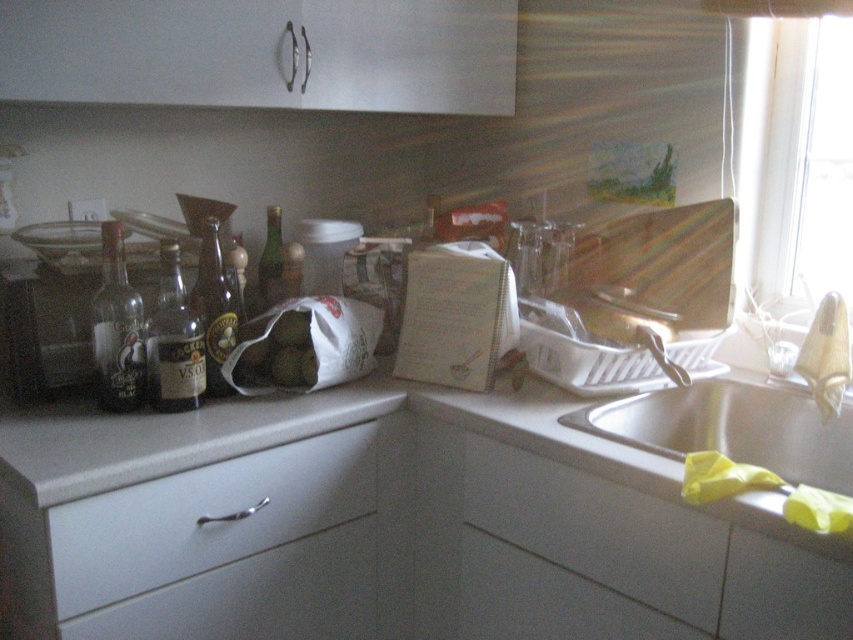
Is stainless steel sink at lower right positioned at the back of dark brown glass bottle at center-left?

No.

Does stainless steel sink at lower right have a larger size compared to dark brown glass bottle at center-left?

Correct, stainless steel sink at lower right is larger in size than dark brown glass bottle at center-left.

Is point (755, 387) farther from viewer compared to point (222, 276)?

Yes, it is behind point (222, 276).

At what (x,y) coordinates should I click in order to perform the action: click on stainless steel sink at lower right. Please return your answer as a coordinate pair (x, y). The height and width of the screenshot is (640, 853). Looking at the image, I should click on (732, 428).

Is point (682, 451) closer to viewer compared to point (120, 284)?

No, (682, 451) is further to viewer.

Is stainless steel sink at lower right to the left of clear glass bottle at left from the viewer's perspective?

In fact, stainless steel sink at lower right is to the right of clear glass bottle at left.

Describe the element at coordinates (732, 428) in the screenshot. I see `stainless steel sink at lower right` at that location.

The image size is (853, 640). I want to click on stainless steel sink at lower right, so click(x=732, y=428).

Is wooden cutting board at sink further to camera compared to white matte drawer at lower center?

Yes.

Which is below, wooden cutting board at sink or white matte drawer at lower center?

white matte drawer at lower center is below.

You are a GUI agent. You are given a task and a screenshot of the screen. Output one action in this format:
    pyautogui.click(x=<x>, y=<y>)
    Task: Click on the wooden cutting board at sink
    
    Given the screenshot: What is the action you would take?
    pyautogui.click(x=637, y=298)